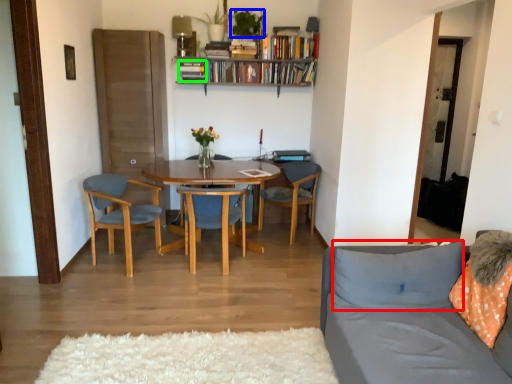
Question: Considering the real-world distances, which object is closest to pillow (highlighted by a red box)? houseplant (highlighted by a blue box) or book (highlighted by a green box).

Choices:
 (A) houseplant
 (B) book

Answer: (A)